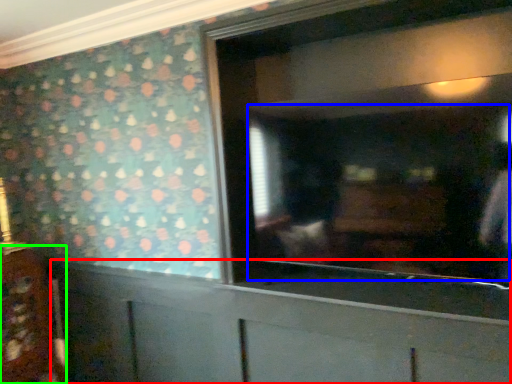
Question: Estimate the real-world distances between objects in this image. Which object is farther from cabinetry (highlighted by a red box), mirror (highlighted by a blue box) or cabinetry (highlighted by a green box)?

Choices:
 (A) mirror
 (B) cabinetry

Answer: (B)